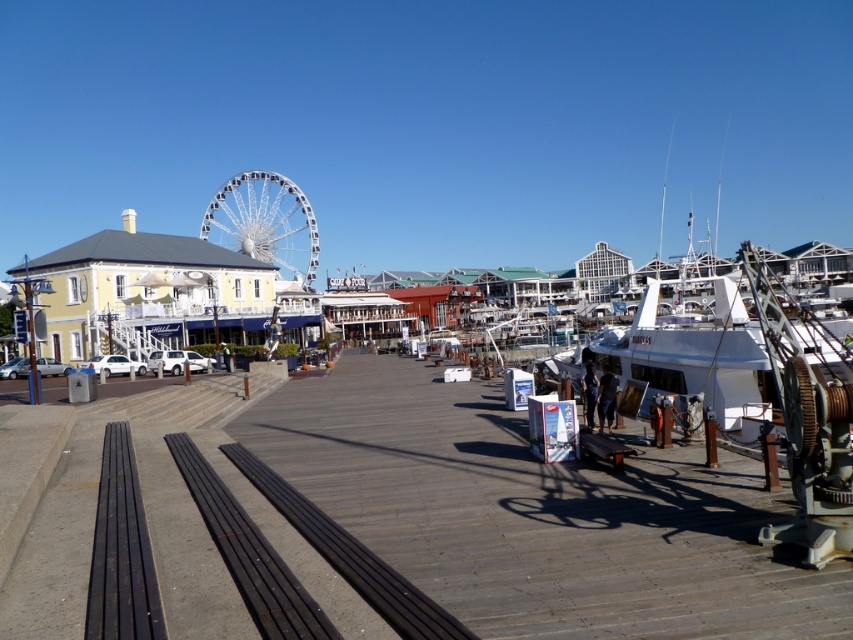
Question: Does white matte boat at right have a greater width compared to white metallic ferris wheel at upper left?

Choices:
 (A) yes
 (B) no

Answer: (A)

Question: Is wooden at center to the right of white metallic ferris wheel at upper left from the viewer's perspective?

Choices:
 (A) yes
 (B) no

Answer: (A)

Question: Which object appears closest to the camera in this image?

Choices:
 (A) white matte boat at right
 (B) white metallic ferris wheel at upper left
 (C) wooden at center

Answer: (C)

Question: Which object is the closest to the white matte boat at right?

Choices:
 (A) white metallic ferris wheel at upper left
 (B) wooden at center

Answer: (B)

Question: Is wooden at center wider than white metallic ferris wheel at upper left?

Choices:
 (A) no
 (B) yes

Answer: (A)

Question: Which of the following is the farthest from the observer?

Choices:
 (A) (242, 250)
 (B) (732, 394)

Answer: (A)